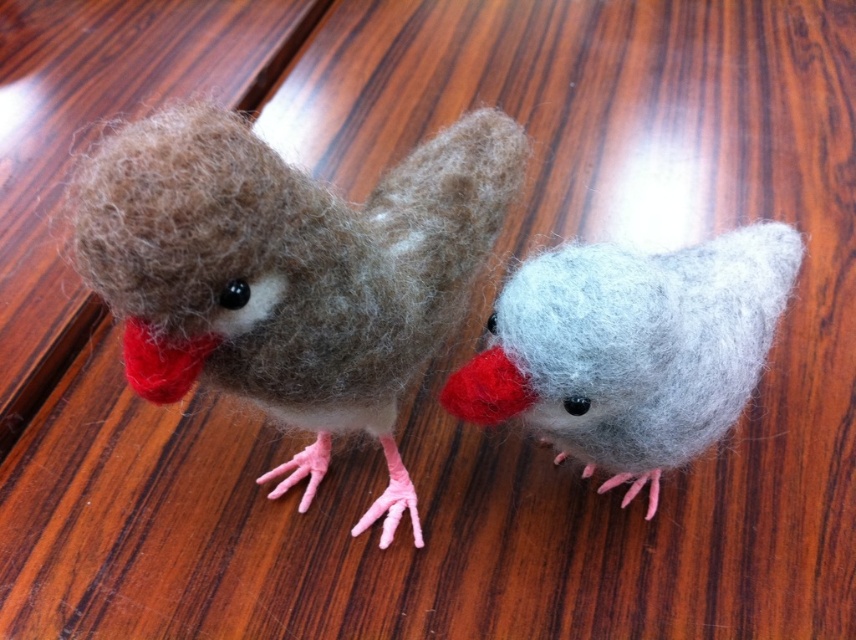
Does light gray felt bird at center have a larger size compared to matte red beak at center?

Yes, light gray felt bird at center is bigger than matte red beak at center.

Which is above, light gray felt bird at center or matte red beak at center?

light gray felt bird at center is higher up.

Locate an element on the screen. This screenshot has height=640, width=856. light gray felt bird at center is located at coordinates tap(631, 348).

Does point (195, 280) lie behind point (734, 292)?

No, (195, 280) is in front of (734, 292).

Locate an element on the screen. fuzzy brown bird at left is located at coordinates (296, 268).

Does fuzzy red beak at left have a larger size compared to matte red beak at center?

Correct, fuzzy red beak at left is larger in size than matte red beak at center.

In the scene shown: Does fuzzy red beak at left have a lesser height compared to matte red beak at center?

In fact, fuzzy red beak at left may be taller than matte red beak at center.

Which is behind, point (158, 371) or point (461, 388)?

The point (461, 388) is behind.

Find the location of `fuzzy red beak at left`. fuzzy red beak at left is located at coordinates (162, 362).